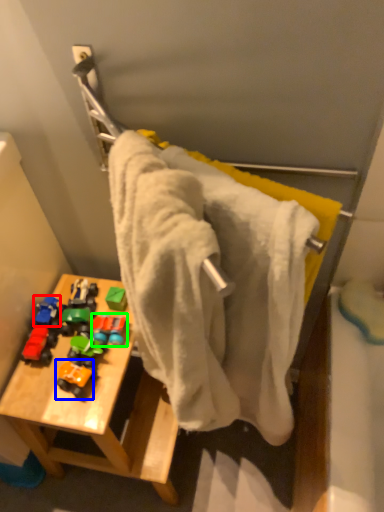
Question: Considering the real-world distances, which object is closest to toy (highlighted by a red box)? toy (highlighted by a blue box) or toy (highlighted by a green box).

Choices:
 (A) toy
 (B) toy

Answer: (B)